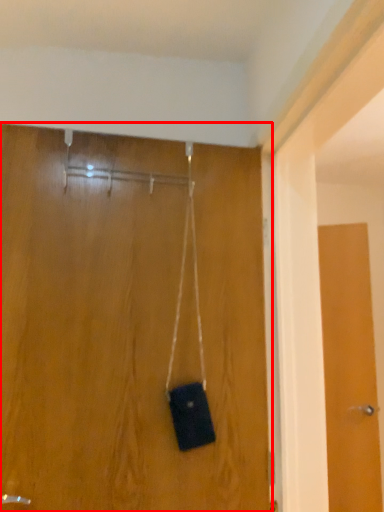
Question: In this image, where is door (annotated by the red box) located relative to door?

Choices:
 (A) left
 (B) right

Answer: (A)